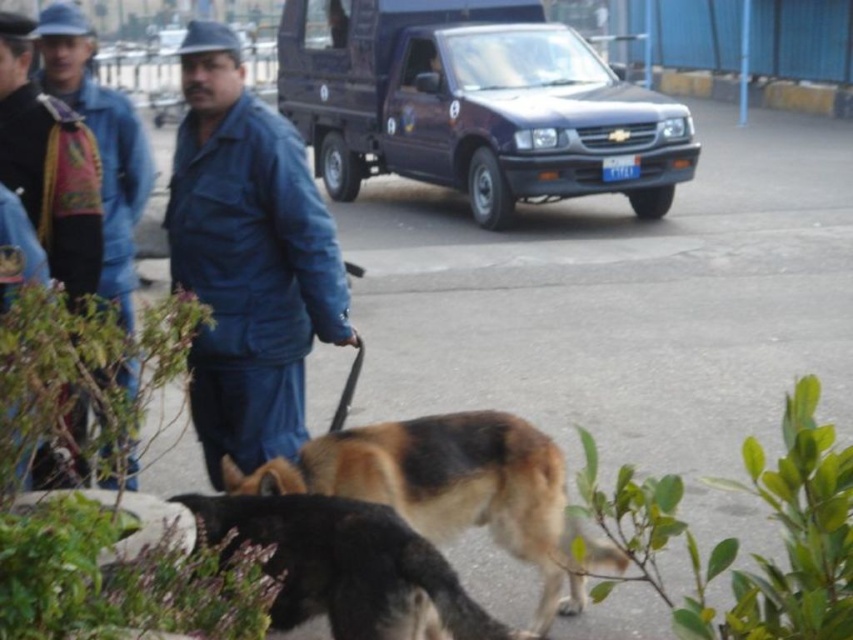
You are standing at the point marked as point (474,104) in the image. What object is located exactly at that point?

The metallic blue truck at upper center is located exactly at point (474,104).

You are a photographer standing in the parking area and want to take a photo of both point [614,120] and point [90,33]. Which point is closer to your camera?

Point [90,33] is closer to the camera than point [614,120].

You are a photographer standing in the scene. You want to take a photo that includes both the blue denim jacket at center and the brown fur dog at lower center. Which object should be placed closer to the camera to ensure both are in focus?

The blue denim jacket at center is taller than the brown fur dog at lower center. To ensure both are in focus, the photographer should place the blue denim jacket at center closer to the camera since it is taller and needs to be within the same focal plane as the shorter brown fur dog at lower center.